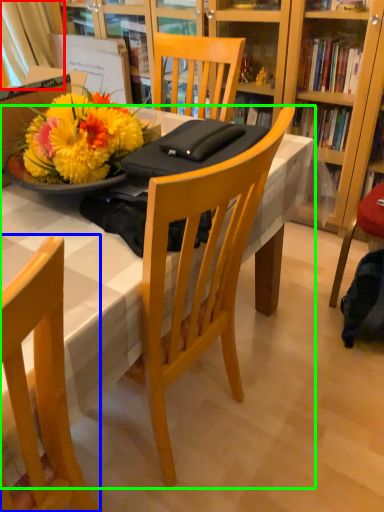
Question: Considering the real-world distances, which object is closest to curtain (highlighted by a red box)? chair (highlighted by a blue box) or desk (highlighted by a green box).

Choices:
 (A) chair
 (B) desk

Answer: (B)